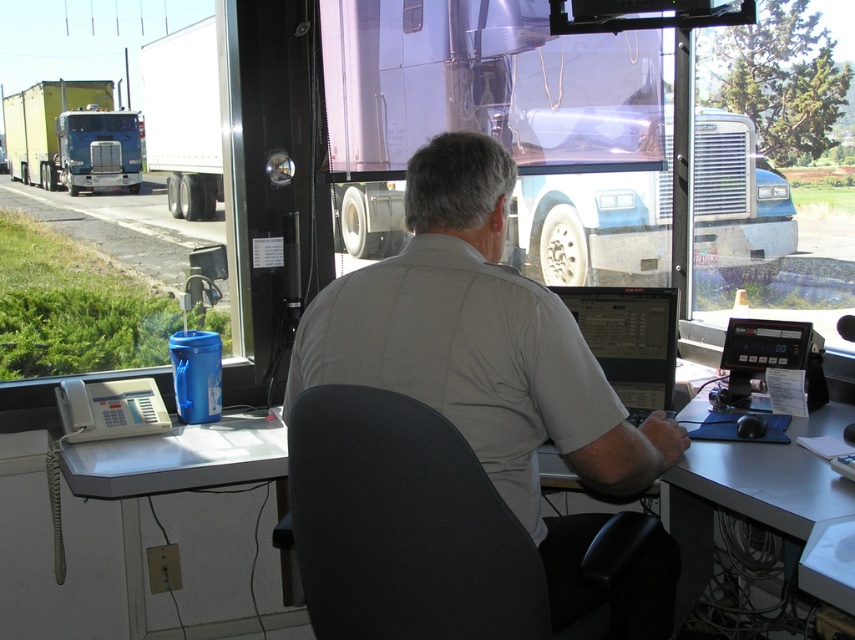
You are a delivery person who needs to sit down at the white plastic table at lower left. Is the black fabric chair at center positioned in a way that you can easily reach the table?

The black fabric chair at center is in front of the white plastic table at lower left, so yes, the chair is positioned directly in front of the table, making it easy to reach.

You are standing in the truck stop and want to know which of the two points, point (553, 316) or point (498, 520), is closer to you. Can you determine this based on their positions?

Point (553, 316) is further to the camera than point (498, 520), so point (498, 520) is closer to you.

You are a delivery person who needs to place a package on a table. The package requires 1.5 meters of space to be placed safely. Given the distance between the gray plastic table at center and the white plastic table at lower left, can you fit the package between them?

The gray plastic table at center and the white plastic table at lower left are 1.32 meters apart, which is less than the required 1.5 meters. Therefore, the package cannot be safely placed between them.